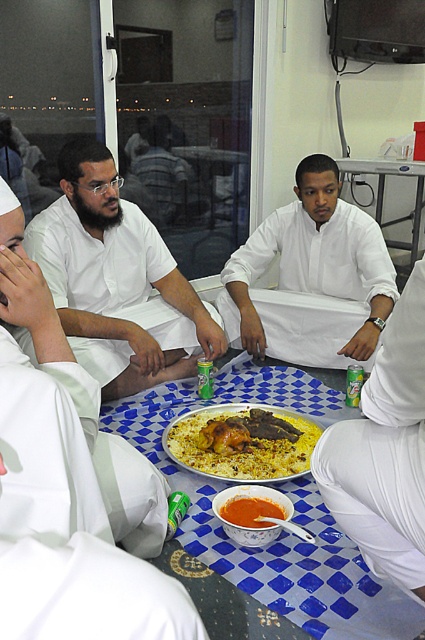
Question: Which of the following is the farthest from the observer?

Choices:
 (A) white cotton robe at lower right
 (B) white matte/soft shirt at center
 (C) yellow rice with chicken at center

Answer: (C)

Question: Which point is farther to the camera?

Choices:
 (A) blue checkered tablecloth at center
 (B) blue checkered table at center
 (C) white matte robe at lower left
 (D) white matte/soft shirt at center

Answer: (B)

Question: Can you confirm if blue checkered tablecloth at center is thinner than white cotton robe at lower right?

Choices:
 (A) yes
 (B) no

Answer: (B)

Question: Can you confirm if white matte robe at lower left is positioned to the left of blue checkered table at center?

Choices:
 (A) yes
 (B) no

Answer: (A)

Question: Can you confirm if matte white shirt at center is positioned to the right of white matte/soft shirt at center?

Choices:
 (A) yes
 (B) no

Answer: (B)

Question: Which is nearer to the blue checkered tablecloth at center?

Choices:
 (A) white cotton robe at lower right
 (B) smooth tomato soup bowl at center

Answer: (B)